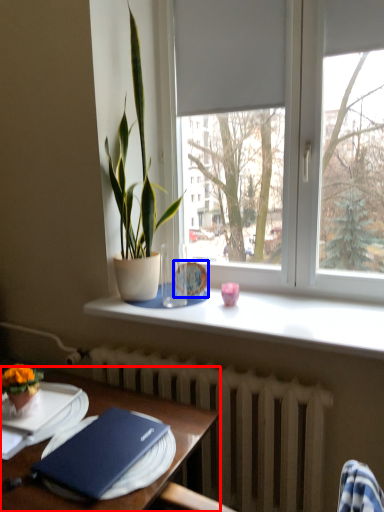
Question: Which object appears farthest to the camera in this image, table (highlighted by a red box) or tableware (highlighted by a blue box)?

Choices:
 (A) table
 (B) tableware

Answer: (B)